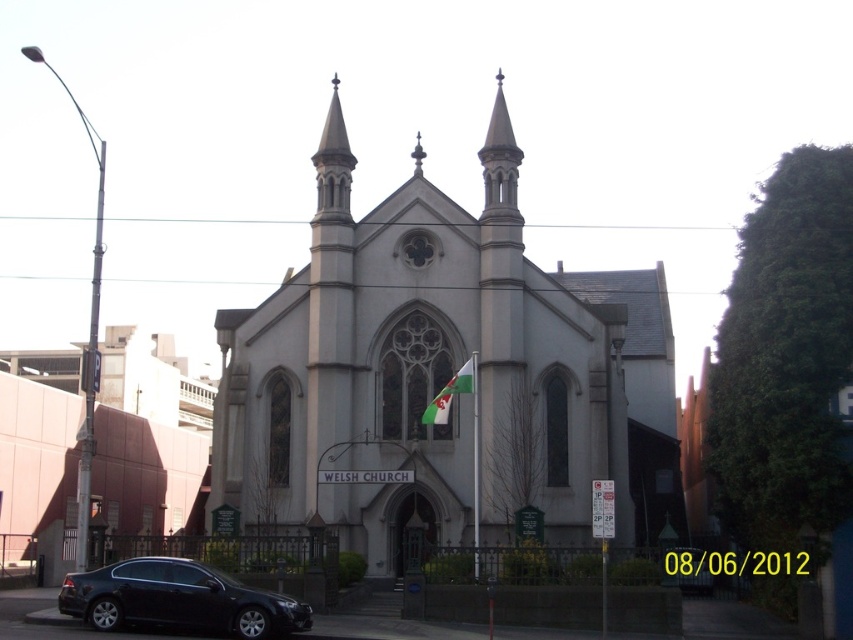
Question: Among these points, which one is farthest from the camera?

Choices:
 (A) (230, 605)
 (B) (347, 145)
 (C) (500, 88)
 (D) (471, 378)

Answer: (B)

Question: Which of the following is the closest to the observer?

Choices:
 (A) smooth gray spire at center
 (B) white stone church at center
 (C) white fabric flag at center

Answer: (B)

Question: Does white stone church at center have a lesser width compared to smooth gray spire at center?

Choices:
 (A) yes
 (B) no

Answer: (B)

Question: Does white stone church at center lie in front of matte black sedan at lower left?

Choices:
 (A) yes
 (B) no

Answer: (B)

Question: Is smooth gray spire at center behind white fabric flag at center?

Choices:
 (A) no
 (B) yes

Answer: (B)

Question: Among these objects, which one is farthest from the camera?

Choices:
 (A) white fabric flag at center
 (B) matte black sedan at lower left
 (C) white stone church at center
 (D) smooth gray spire at center

Answer: (D)